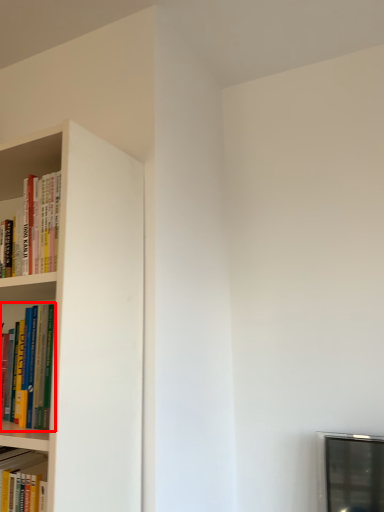
Question: Observing the image, what is the correct spatial positioning of book (annotated by the red box) in reference to book?

Choices:
 (A) left
 (B) right

Answer: (B)